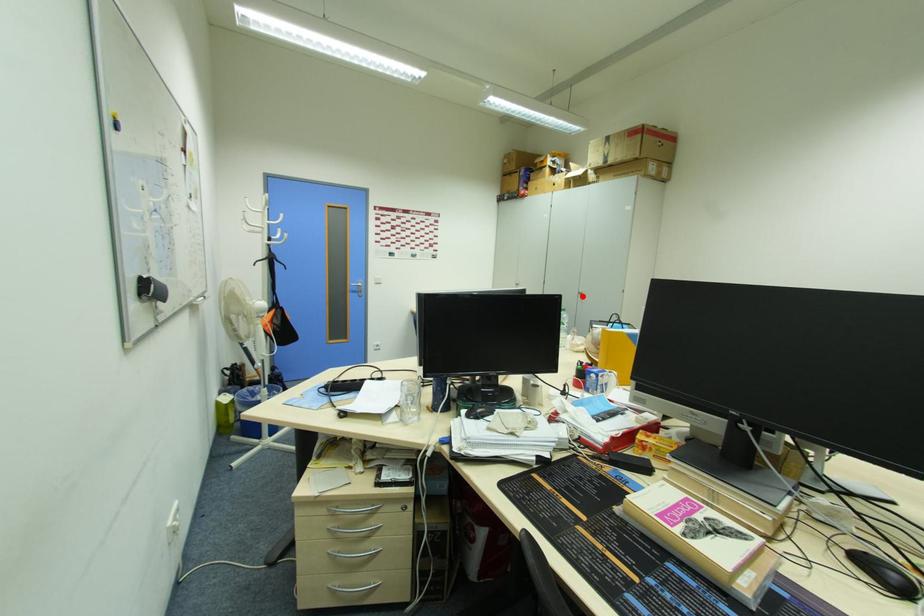
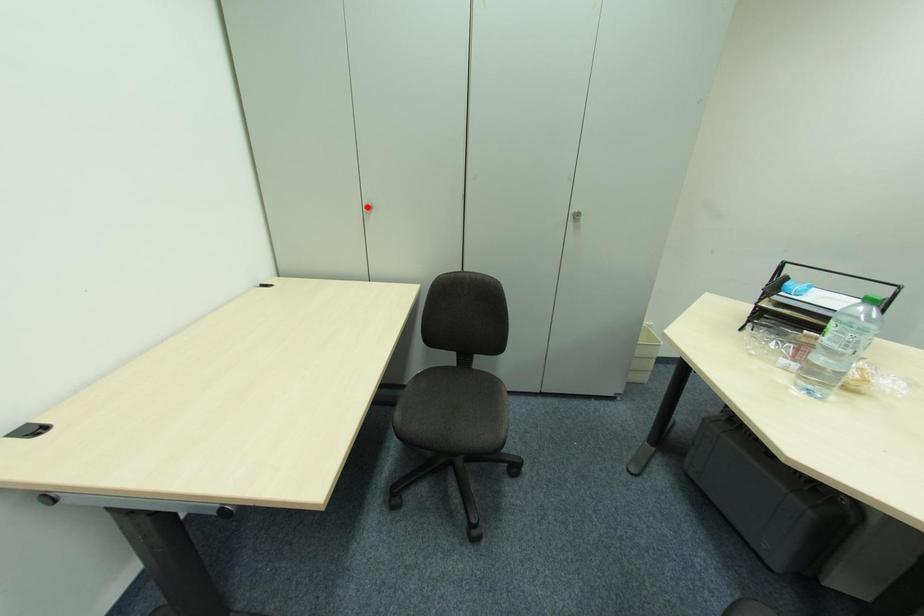
I am providing you with two images of the same scene from different viewpoints. A red point is marked on the first image and another point is marked on the second image. Is the red point in image1 aligned with the point shown in image2?

No